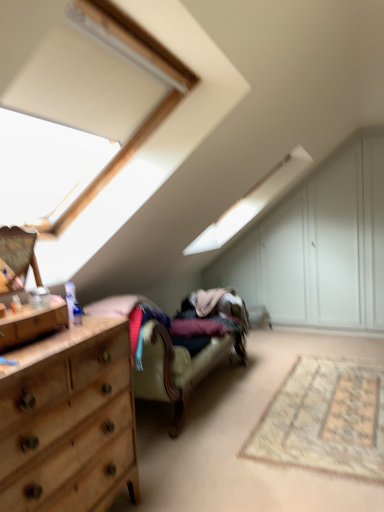
Question: Considering the positions of velvet beige couch at center and beige woven rug at lower right in the image, is velvet beige couch at center wider or thinner than beige woven rug at lower right?

Choices:
 (A) thin
 (B) wide

Answer: (A)

Question: In the image, is velvet beige couch at center on the left side or the right side of beige woven rug at lower right?

Choices:
 (A) left
 (B) right

Answer: (A)

Question: Estimate the real-world distances between objects in this image. Which object is closer to the wooden dresser at left?

Choices:
 (A) wooden dresser at left
 (B) white wood dresser at upper right
 (C) beige woven rug at lower right
 (D) velvet beige couch at center
 (E) wooden dresser at left

Answer: (E)

Question: Which of these objects is positioned closest to the white wood dresser at upper right?

Choices:
 (A) velvet beige couch at center
 (B) beige woven rug at lower right
 (C) wooden dresser at left
 (D) wooden dresser at left
 (E) wooden dresser at left

Answer: (A)